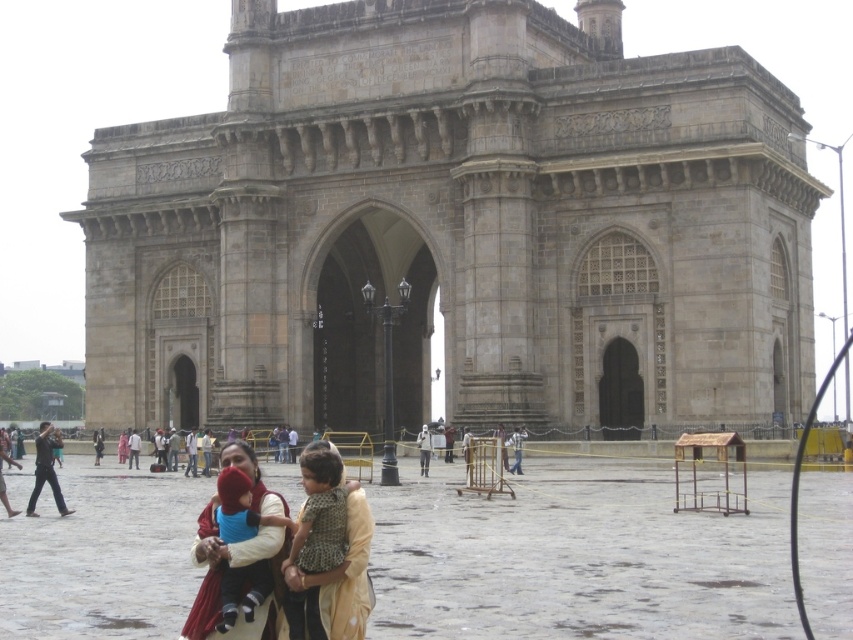
Question: Is stone gateway of india at center further to camera compared to light brown fabric shirt at center?

Choices:
 (A) no
 (B) yes

Answer: (A)

Question: Is stone gateway of india at center wider than matte blue fabric at center?

Choices:
 (A) no
 (B) yes

Answer: (B)

Question: Which is nearer to the brown textured dress at center?

Choices:
 (A) dark brown leather jacket at center
 (B) light brown fabric shirt at center
 (C) dark brown leather jacket at lower left
 (D) matte blue fabric at center

Answer: (D)

Question: Which object appears farthest from the camera in this image?

Choices:
 (A) brown textured dress at center
 (B) matte blue fabric at center
 (C) beige fabric dress at center
 (D) dark brown leather jacket at lower left

Answer: (D)

Question: Can you confirm if brown textured dress at center is smaller than dark brown leather jacket at center?

Choices:
 (A) no
 (B) yes

Answer: (A)

Question: Which point is farther to the camera?

Choices:
 (A) light brown fabric shirt at center
 (B) brown textured dress at center
 (C) dark brown leather jacket at lower left

Answer: (A)